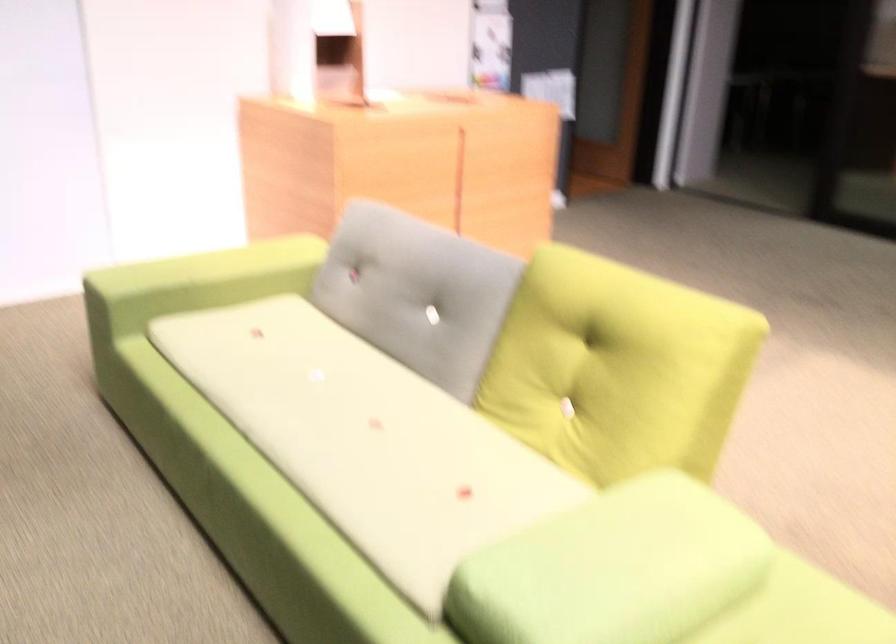
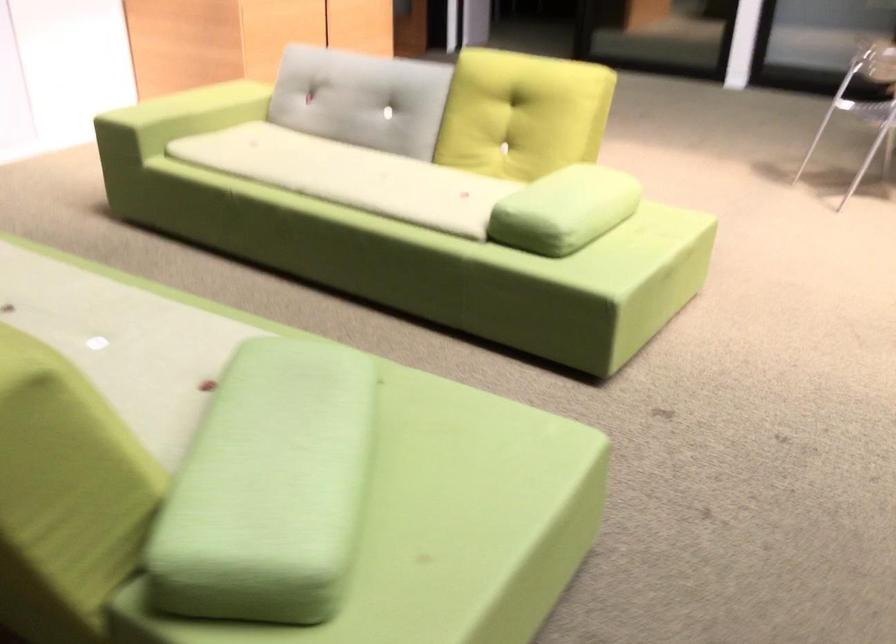
The point at (400, 301) is marked in the first image. Where is the corresponding point in the second image?

(362, 99)